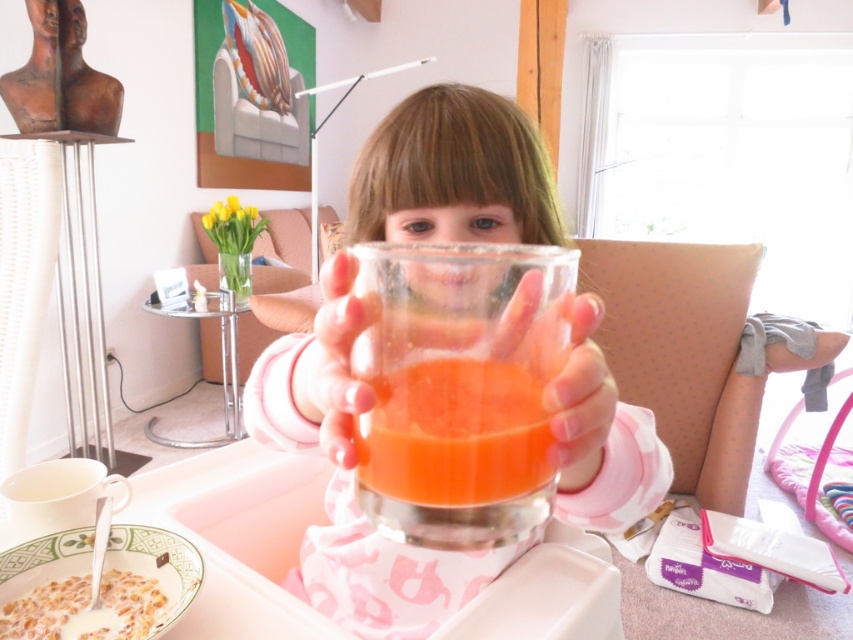
Question: Which of the following is the farthest from the observer?

Choices:
 (A) white creamy cereal at lower left
 (B) transparent glass cup at center

Answer: (A)

Question: Which object is the closest to the white creamy cereal at lower left?

Choices:
 (A) translucent glass cup at center
 (B) transparent glass cup at center
 (C) translucent glass juice at center

Answer: (B)

Question: Is translucent glass cup at center bigger than translucent glass juice at center?

Choices:
 (A) no
 (B) yes

Answer: (B)

Question: Estimate the real-world distances between objects in this image. Which object is farther from the white creamy cereal at lower left?

Choices:
 (A) transparent glass cup at center
 (B) translucent glass cup at center
 (C) translucent glass juice at center

Answer: (B)

Question: Does transparent glass cup at center appear under white creamy cereal at lower left?

Choices:
 (A) no
 (B) yes

Answer: (A)

Question: Is translucent glass cup at center to the right of translucent glass juice at center from the viewer's perspective?

Choices:
 (A) no
 (B) yes

Answer: (B)